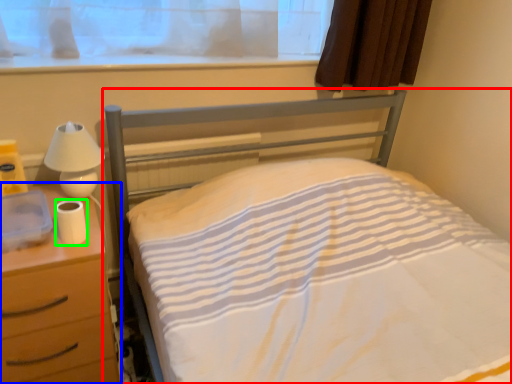
Question: Which object is positioned closest to bed (highlighted by a red box)? Select from nightstand (highlighted by a blue box) and toilet paper (highlighted by a green box).

Choices:
 (A) nightstand
 (B) toilet paper

Answer: (A)